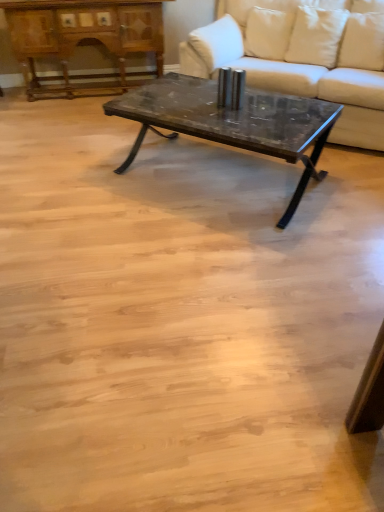
Question: Is white fabric pillow at upper right, marked as the second pillow in a right-to-left arrangement, oriented towards wooden polished dresser at upper left?

Choices:
 (A) no
 (B) yes

Answer: (A)

Question: Can you confirm if white fabric pillow at upper right, the first pillow when ordered from left to right, is wider than wooden polished dresser at upper left?

Choices:
 (A) no
 (B) yes

Answer: (A)

Question: Is white fabric pillow at upper right, the first pillow when ordered from left to right, next to wooden polished dresser at upper left?

Choices:
 (A) no
 (B) yes

Answer: (A)

Question: Is white fabric pillow at upper right, marked as the second pillow in a right-to-left arrangement, further to the viewer compared to wooden polished dresser at upper left?

Choices:
 (A) no
 (B) yes

Answer: (A)

Question: From a real-world perspective, is white fabric pillow at upper right, marked as the second pillow in a right-to-left arrangement, physically below wooden polished dresser at upper left?

Choices:
 (A) yes
 (B) no

Answer: (B)

Question: Is white fabric pillow at upper right, the first pillow when ordered from left to right, not close to wooden polished dresser at upper left?

Choices:
 (A) no
 (B) yes

Answer: (A)

Question: Can you confirm if white fabric pillow at upper right, the first pillow when ordered from left to right, is taller than white fabric couch at center?

Choices:
 (A) yes
 (B) no

Answer: (B)

Question: Can you confirm if white fabric pillow at upper right, marked as the second pillow in a right-to-left arrangement, is shorter than white fabric couch at center?

Choices:
 (A) yes
 (B) no

Answer: (A)

Question: Considering the relative positions of white fabric pillow at upper right, marked as the second pillow in a right-to-left arrangement, and white fabric couch at center in the image provided, is white fabric pillow at upper right, marked as the second pillow in a right-to-left arrangement, behind white fabric couch at center?

Choices:
 (A) no
 (B) yes

Answer: (B)

Question: Can you confirm if white fabric pillow at upper right, marked as the second pillow in a right-to-left arrangement, is bigger than white fabric couch at center?

Choices:
 (A) no
 (B) yes

Answer: (A)

Question: Can you confirm if white fabric pillow at upper right, the first pillow when ordered from left to right, is positioned to the left of white fabric couch at center?

Choices:
 (A) yes
 (B) no

Answer: (A)

Question: From a real-world perspective, is white fabric pillow at upper right, marked as the second pillow in a right-to-left arrangement, on top of white fabric couch at center?

Choices:
 (A) yes
 (B) no

Answer: (A)

Question: Are white fabric pillow at upper right, marked as the second pillow in a right-to-left arrangement, and dark gray stone coffee table at center far apart?

Choices:
 (A) yes
 (B) no

Answer: (B)